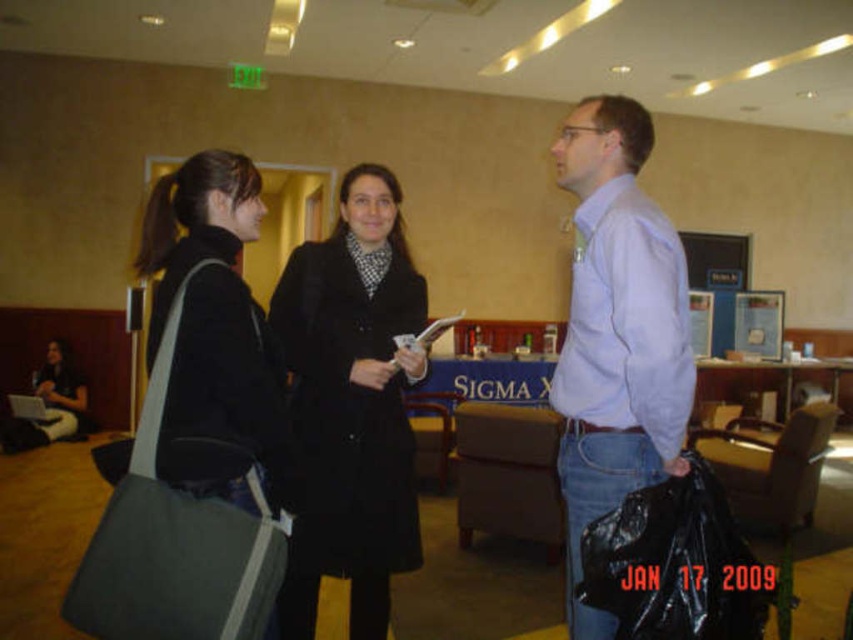
Is the position of black wool coat at center less distant than that of dark green canvas bag at left?

No, black wool coat at center is further to the viewer.

Who is more forward, (387, 380) or (274, 428)?

Positioned in front is point (274, 428).

Image resolution: width=853 pixels, height=640 pixels. Describe the element at coordinates (352, 404) in the screenshot. I see `black wool coat at center` at that location.

Identify the location of black wool coat at center. (352, 404).

Is light blue shirt at center positioned in front of dark green canvas bag at left?

No, light blue shirt at center is further to the viewer.

Which is above, light blue shirt at center or dark green canvas bag at left?

dark green canvas bag at left

Who is more distant from viewer, (640, 358) or (161, 301)?

The point (161, 301) is behind.

Find the location of a particular element. The image size is (853, 640). light blue shirt at center is located at coordinates (616, 332).

What do you see at coordinates (352, 404) in the screenshot? This screenshot has height=640, width=853. I see `black wool coat at center` at bounding box center [352, 404].

Identify the location of black wool coat at center. (352, 404).